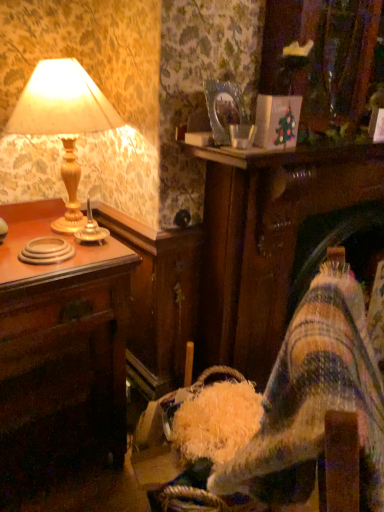
The image size is (384, 512). Identify the location of vacant area that is in front of matte gold lamp at left. (59, 262).